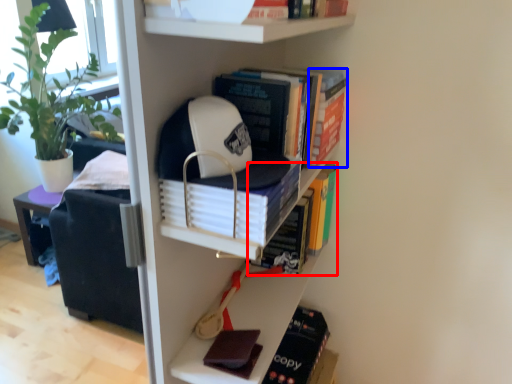
Question: Among these objects, which one is farthest to the camera, book (highlighted by a red box) or book (highlighted by a blue box)?

Choices:
 (A) book
 (B) book

Answer: (A)